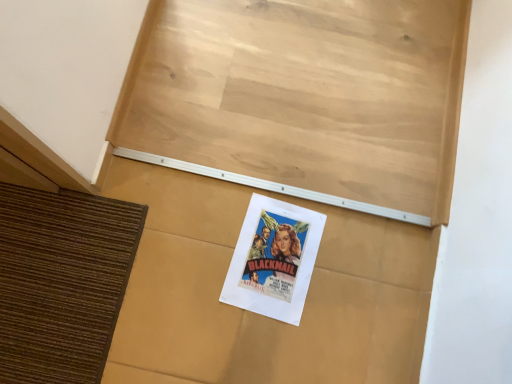
Locate an element on the screen. free spot in front of white paper poster at center is located at coordinates (176, 308).